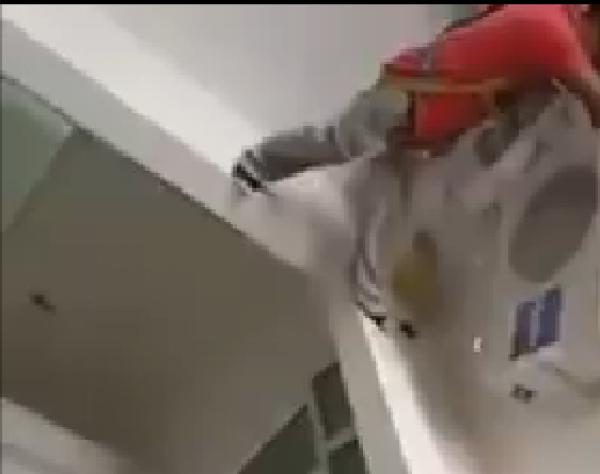
Where is `washing machine fitting gaps`? The height and width of the screenshot is (474, 600). washing machine fitting gaps is located at coordinates (292, 450), (328, 402), (335, 470).